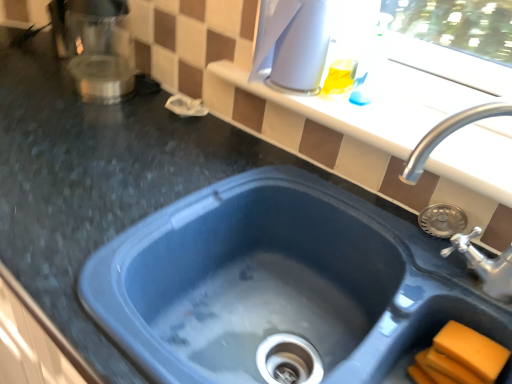
This screenshot has width=512, height=384. Identify the location of blue plastic sink at upper right, which appears as the 2th sink when viewed from the left. (448, 135).

This screenshot has height=384, width=512. What do you see at coordinates (284, 257) in the screenshot?
I see `blue plastic sink at center, the 1th sink viewed from the left` at bounding box center [284, 257].

How much space does satin silver coffee maker at upper left, which is the second appliance in right-to-left order, occupy vertically?

It is 24.86 centimeters.

This screenshot has width=512, height=384. What do you see at coordinates (295, 46) in the screenshot?
I see `white glossy kettle at upper center, the 1th appliance from the right` at bounding box center [295, 46].

What is the approximate width of orange sponge at lower right?

orange sponge at lower right is 9.93 centimeters wide.

Where is `blue plastic sink at upper right, positioned as the first sink in right-to-left order`? The width and height of the screenshot is (512, 384). blue plastic sink at upper right, positioned as the first sink in right-to-left order is located at coordinates (448, 135).

From their relative heights in the image, would you say satin silver coffee maker at upper left, which is the first appliance from left to right, is taller or shorter than white glossy window sill at upper center?

Considering their sizes, satin silver coffee maker at upper left, which is the first appliance from left to right, has more height than white glossy window sill at upper center.

From the image's perspective, is satin silver coffee maker at upper left, which is the first appliance from left to right, on top of white glossy window sill at upper center?

Yes, from the image's perspective, satin silver coffee maker at upper left, which is the first appliance from left to right, is over white glossy window sill at upper center.

Looking at this image, which point is more distant from viewer, [74,55] or [482,139]?

The point [74,55] is more distant.

Is orange sponge at lower right spatially inside blue plastic sink at upper right, which appears as the 2th sink when viewed from the left, or outside of it?

orange sponge at lower right exists outside the volume of blue plastic sink at upper right, which appears as the 2th sink when viewed from the left.

Which object is thinner, orange sponge at lower right or blue plastic sink at upper right, positioned as the first sink in right-to-left order?

orange sponge at lower right is thinner.

In the scene shown: From the image's perspective, is orange sponge at lower right under blue plastic sink at upper right, positioned as the first sink in right-to-left order?

Yes, from the image's perspective, orange sponge at lower right is below blue plastic sink at upper right, positioned as the first sink in right-to-left order.

Does point (489, 352) lie behind point (499, 288)?

No, it is not.

Is point (504, 146) closer or farther from the camera than point (111, 5)?

Point (504, 146).

Is white glossy window sill at upper center bigger or smaller than satin silver coffee maker at upper left, which is the second appliance in right-to-left order?

Considering their sizes, white glossy window sill at upper center takes up less space than satin silver coffee maker at upper left, which is the second appliance in right-to-left order.

Is white glossy window sill at upper center oriented away from satin silver coffee maker at upper left, which is the first appliance from left to right?

No, satin silver coffee maker at upper left, which is the first appliance from left to right, is not at the back of white glossy window sill at upper center.

Is the position of white glossy window sill at upper center more distant than that of satin silver coffee maker at upper left, which is the first appliance from left to right?

No, white glossy window sill at upper center is closer to the camera.

Which is behind, point (490, 357) or point (429, 309)?

Positioned behind is point (429, 309).

Which is correct: orange sponge at lower right is inside blue plastic sink at center, which is the second sink in right-to-left order, or outside of it?

orange sponge at lower right fits inside blue plastic sink at center, which is the second sink in right-to-left order.

How much distance is there between orange sponge at lower right and blue plastic sink at center, the 1th sink viewed from the left?

orange sponge at lower right and blue plastic sink at center, the 1th sink viewed from the left, are 10.94 inches apart from each other.

Locate an element on the screen. sink located underneath the orange sponge at lower right (from a real-world perspective) is located at coordinates (284, 257).

From a real-world perspective, is white glossy window sill at upper center over white glossy kettle at upper center, placed as the 2th appliance when sorted from left to right?

No, from a real-world perspective, white glossy window sill at upper center is not over white glossy kettle at upper center, placed as the 2th appliance when sorted from left to right

Consider the image. Based on their positions, is white glossy window sill at upper center located to the left or right of white glossy kettle at upper center, the 1th appliance from the right?

From the image, it's evident that white glossy window sill at upper center is to the right of white glossy kettle at upper center, the 1th appliance from the right.

Is white glossy window sill at upper center with white glossy kettle at upper center, the 1th appliance from the right?

white glossy window sill at upper center and white glossy kettle at upper center, the 1th appliance from the right, are not in contact.

Who is more distant, white glossy window sill at upper center or white glossy kettle at upper center, the 1th appliance from the right?

white glossy kettle at upper center, the 1th appliance from the right, is behind.

Between white glossy window sill at upper center and orange sponge at lower right, which one appears on the right side from the viewer's perspective?

From the viewer's perspective, orange sponge at lower right appears more on the right side.

From the image's perspective, does white glossy window sill at upper center appear lower than orange sponge at lower right?

No, from the image's perspective, white glossy window sill at upper center is not below orange sponge at lower right.

Consider the image. Which is in front, white glossy window sill at upper center or orange sponge at lower right?

orange sponge at lower right is in front.

Would you say white glossy window sill at upper center is a long distance from orange sponge at lower right?

No, there isn't a large distance between white glossy window sill at upper center and orange sponge at lower right.

Measure the distance from satin silver coffee maker at upper left, which is the second appliance in right-to-left order, to white glossy kettle at upper center, placed as the 2th appliance when sorted from left to right.

satin silver coffee maker at upper left, which is the second appliance in right-to-left order, is 18.43 inches from white glossy kettle at upper center, placed as the 2th appliance when sorted from left to right.

Can you confirm if satin silver coffee maker at upper left, which is the second appliance in right-to-left order, is thinner than white glossy kettle at upper center, placed as the 2th appliance when sorted from left to right?

Incorrect, the width of satin silver coffee maker at upper left, which is the second appliance in right-to-left order, is not less than that of white glossy kettle at upper center, placed as the 2th appliance when sorted from left to right.

From the image's perspective, which one is positioned higher, satin silver coffee maker at upper left, which is the second appliance in right-to-left order, or white glossy kettle at upper center, placed as the 2th appliance when sorted from left to right?

satin silver coffee maker at upper left, which is the second appliance in right-to-left order, is shown above in the image.

Is the surface of satin silver coffee maker at upper left, which is the first appliance from left to right, in direct contact with white glossy kettle at upper center, placed as the 2th appliance when sorted from left to right?

No, satin silver coffee maker at upper left, which is the first appliance from left to right, is not next to white glossy kettle at upper center, placed as the 2th appliance when sorted from left to right.

Find the location of `window sill that is below the satin silver coffee maker at upper left, which is the first appliance from left to right (from the image's perspective)`. window sill that is below the satin silver coffee maker at upper left, which is the first appliance from left to right (from the image's perspective) is located at coordinates (347, 113).

At what (x,y) coordinates should I click in order to perform the action: click on the 1st sink to the left of the orange sponge at lower right, starting your count from the anchor. Please return your answer as a coordinate pair (x, y). Looking at the image, I should click on (448, 135).

Looking at the image, which one is located closer to orange sponge at lower right, blue plastic sink at center, which is the second sink in right-to-left order, or satin silver coffee maker at upper left, which is the second appliance in right-to-left order?

blue plastic sink at center, which is the second sink in right-to-left order, is positioned closer to the anchor orange sponge at lower right.

Based on their spatial positions, is blue plastic sink at center, which is the second sink in right-to-left order, or satin silver coffee maker at upper left, which is the first appliance from left to right, closer to blue plastic sink at upper right, positioned as the first sink in right-to-left order?

The object closer to blue plastic sink at upper right, positioned as the first sink in right-to-left order, is blue plastic sink at center, which is the second sink in right-to-left order.

Estimate the real-world distances between objects in this image. Which object is closer to orange sponge at lower right, blue plastic sink at upper right, positioned as the first sink in right-to-left order, or satin silver coffee maker at upper left, which is the first appliance from left to right?

blue plastic sink at upper right, positioned as the first sink in right-to-left order, is positioned closer to the anchor orange sponge at lower right.

Which object lies nearer to the anchor point orange sponge at lower right, white glossy window sill at upper center or blue plastic sink at upper right, positioned as the first sink in right-to-left order?

The object closer to orange sponge at lower right is blue plastic sink at upper right, positioned as the first sink in right-to-left order.

Looking at the image, which one is located further to satin silver coffee maker at upper left, which is the first appliance from left to right, blue plastic sink at center, the 1th sink viewed from the left, or blue plastic sink at upper right, which appears as the 2th sink when viewed from the left?

blue plastic sink at upper right, which appears as the 2th sink when viewed from the left, is positioned further to the anchor satin silver coffee maker at upper left, which is the first appliance from left to right.

When comparing their distances from white glossy window sill at upper center, does blue plastic sink at upper right, positioned as the first sink in right-to-left order, or orange sponge at lower right seem closer?

Based on the image, blue plastic sink at upper right, positioned as the first sink in right-to-left order, appears to be nearer to white glossy window sill at upper center.

Which object lies further to the anchor point white glossy window sill at upper center, orange sponge at lower right or blue plastic sink at upper right, positioned as the first sink in right-to-left order?

orange sponge at lower right lies further to white glossy window sill at upper center than the other object.

Considering their positions, is white glossy window sill at upper center positioned closer to white glossy kettle at upper center, placed as the 2th appliance when sorted from left to right, than blue plastic sink at center, which is the second sink in right-to-left order?

white glossy window sill at upper center is closer to white glossy kettle at upper center, placed as the 2th appliance when sorted from left to right.

You are a GUI agent. You are given a task and a screenshot of the screen. Output one action in this format:
    pyautogui.click(x=<x>, y=<y>)
    Task: Click on the sink situated between satin silver coffee maker at upper left, which is the second appliance in right-to-left order, and blue plastic sink at upper right, positioned as the first sink in right-to-left order, from left to right
    The image size is (512, 384).
    Given the screenshot: What is the action you would take?
    pyautogui.click(x=284, y=257)

Image resolution: width=512 pixels, height=384 pixels. Find the location of `window sill between white glossy kettle at upper center, placed as the 2th appliance when sorted from left to right, and blue plastic sink at upper right, positioned as the first sink in right-to-left order, vertically`. window sill between white glossy kettle at upper center, placed as the 2th appliance when sorted from left to right, and blue plastic sink at upper right, positioned as the first sink in right-to-left order, vertically is located at coordinates (347, 113).

What are the coordinates of `appliance between satin silver coffee maker at upper left, which is the second appliance in right-to-left order, and blue plastic sink at center, the 1th sink viewed from the left, from top to bottom` in the screenshot? It's located at (295, 46).

Locate an element on the screen. The width and height of the screenshot is (512, 384). window sill situated between satin silver coffee maker at upper left, which is the second appliance in right-to-left order, and blue plastic sink at upper right, positioned as the first sink in right-to-left order, from left to right is located at coordinates (347, 113).